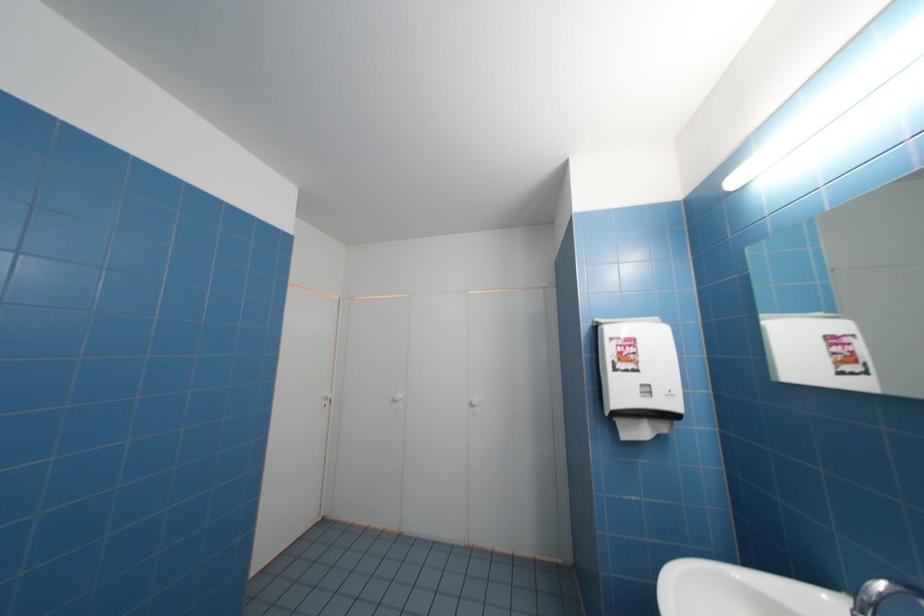
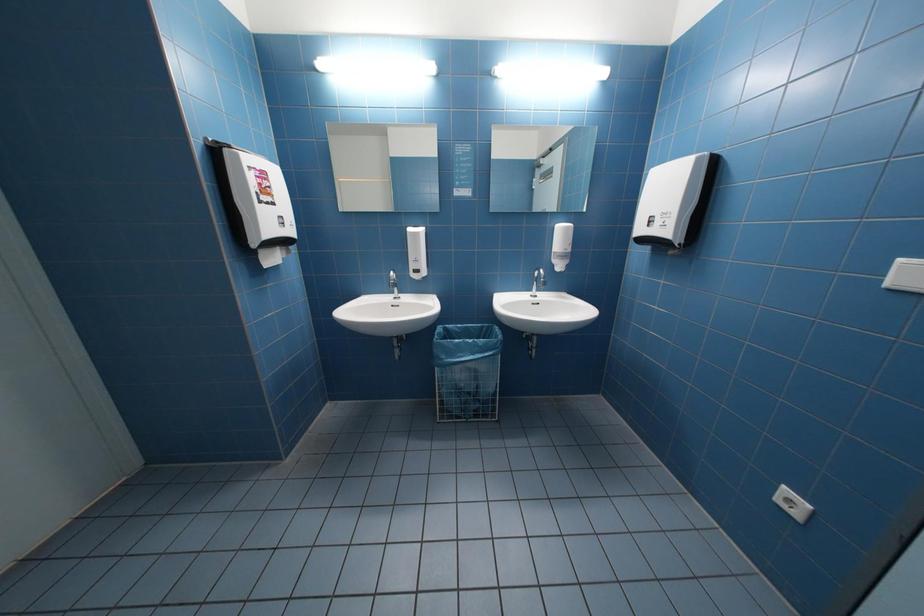
Question: Based on the continuous images, in which direction is the camera rotating? Reply with the corresponding letter.

Choices:
 (A) Left
 (B) Right
 (C) Up
 (D) Down

Answer: (B)